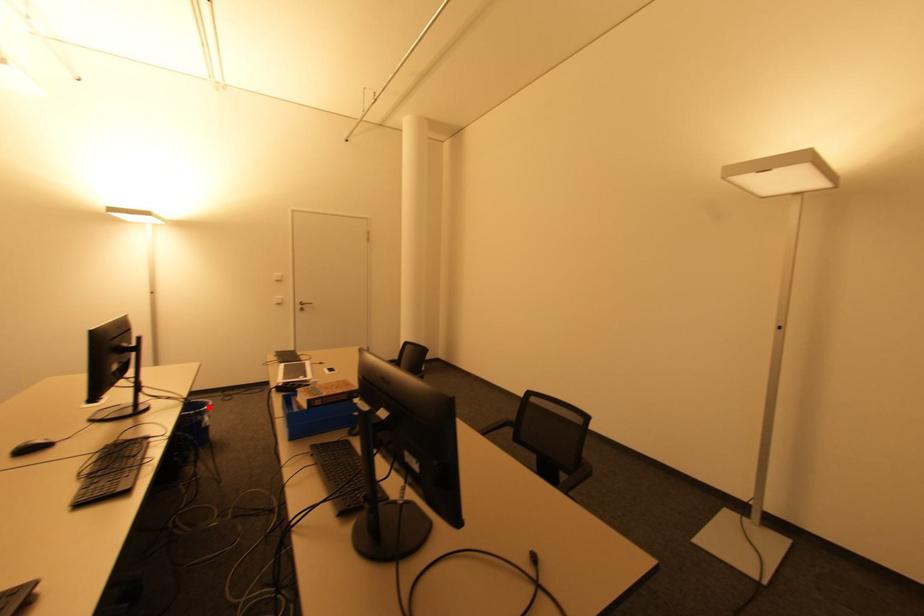
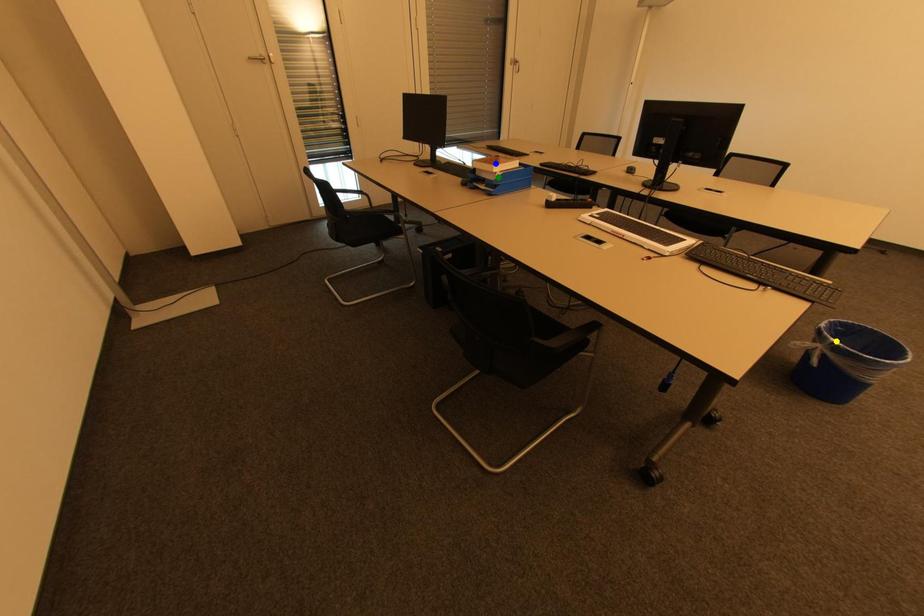
Question: I am providing you with two images of the same scene from different viewpoints. A red point is marked on the first image. You are given multiple points on the second image. Which point in image 2 represents the same 3d spot as the red point in image 1?

Choices:
 (A) yellow point
 (B) green point
 (C) blue point

Answer: (A)